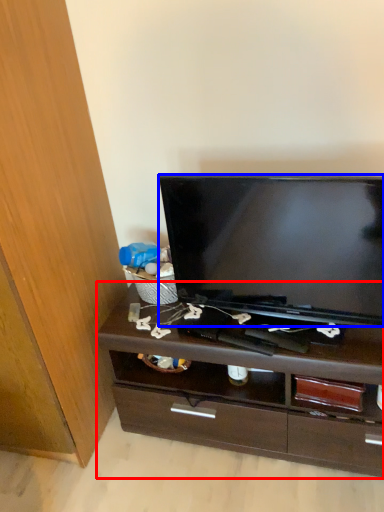
Question: Which of the following is the closest to the observer, chest of drawers (highlighted by a red box) or television (highlighted by a blue box)?

Choices:
 (A) chest of drawers
 (B) television

Answer: (B)